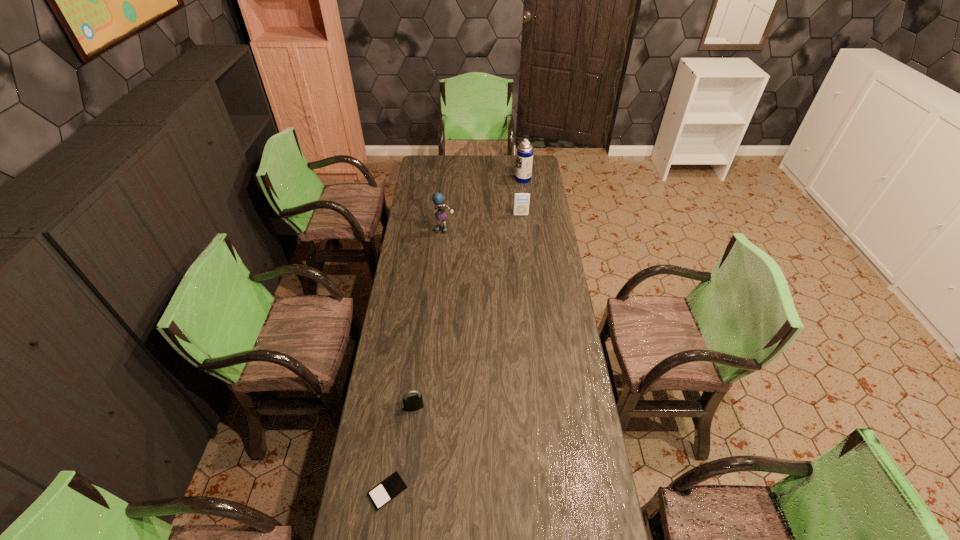
This screenshot has width=960, height=540. Identify the location of vacant region located on the label side of the farthest object. [x=464, y=179].

At what (x,y) coordinates should I click in order to perform the action: click on free location located 0.070m on the front-facing side of the rag doll. Please return your answer as a coordinate pair (x, y). Looking at the image, I should click on (444, 244).

This screenshot has width=960, height=540. I want to click on free space located on the front-facing side of the farther iPod, so click(522, 228).

You are a GUI agent. You are given a task and a screenshot of the screen. Output one action in this format:
    pyautogui.click(x=<x>, y=<y>)
    Task: Click on the blank area located on the front of the second nearest object
    The width and height of the screenshot is (960, 540).
    Given the screenshot: What is the action you would take?
    coord(409,451)

This screenshot has height=540, width=960. I want to click on vacant space positioned 0.360m on the back of the shorter iPod, so click(x=404, y=374).

I want to click on object located in the far edge section of the desktop, so click(524, 160).

Find the location of a particular element. rag doll at the left edge is located at coordinates coord(438,199).

This screenshot has height=540, width=960. Find the location of `padlock present at the left edge`. padlock present at the left edge is located at coordinates (412, 403).

Where is `iPod positioned at the left edge`? Image resolution: width=960 pixels, height=540 pixels. iPod positioned at the left edge is located at coordinates (390, 488).

Find the location of a particular element. aerosol can that is at the right edge is located at coordinates (524, 160).